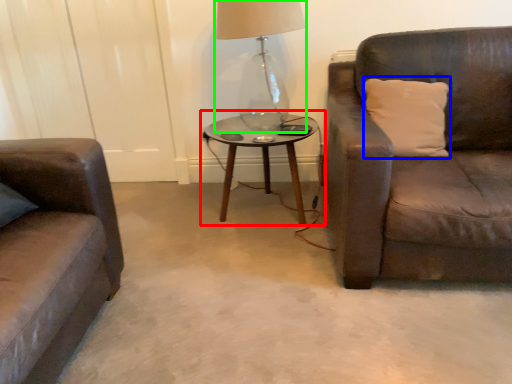
Question: Which object is positioned closest to coffee table (highlighted by a red box)? Select from pillow (highlighted by a blue box) and table lamp (highlighted by a green box).

Choices:
 (A) pillow
 (B) table lamp

Answer: (B)